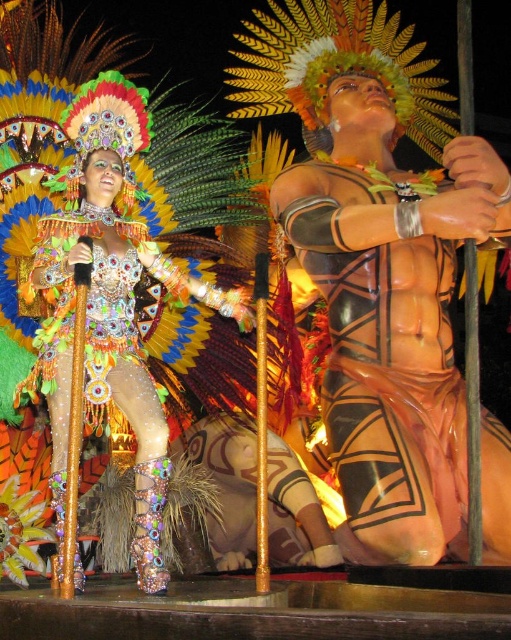
Question: Which point is farther from the camera taking this photo?

Choices:
 (A) (377, 268)
 (B) (52, 257)

Answer: (A)

Question: Does matte orange body paint at center appear on the left side of shiny sequined dress at center?

Choices:
 (A) yes
 (B) no

Answer: (B)

Question: Which of the following is the farthest from the observer?

Choices:
 (A) (167, 568)
 (B) (345, 358)

Answer: (A)

Question: In this image, where is matte orange body paint at center located relative to shiny sequined dress at center?

Choices:
 (A) right
 (B) left

Answer: (A)

Question: In this image, where is matte orange body paint at center located relative to shiny sequined dress at center?

Choices:
 (A) below
 (B) above

Answer: (A)